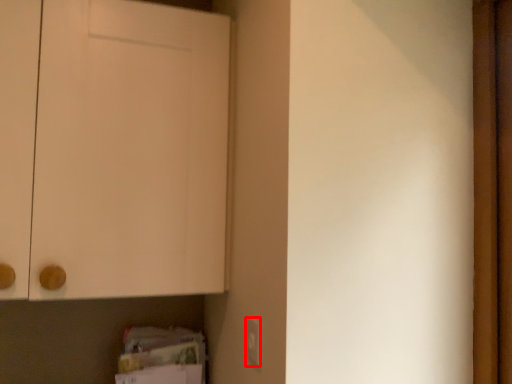
Question: From the image's perspective, where is electric outlet (annotated by the red box) located in relation to door in the image?

Choices:
 (A) above
 (B) below

Answer: (B)